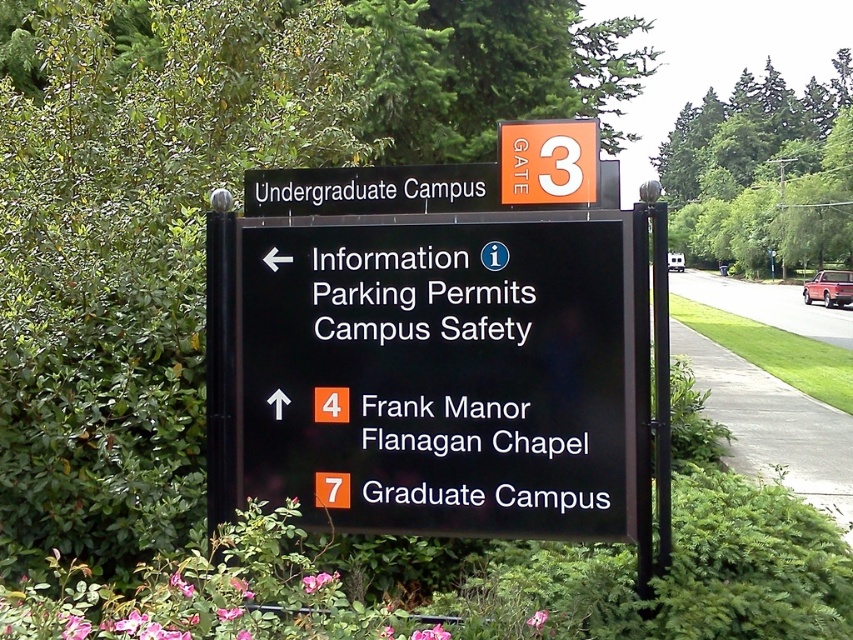
What is the location of the point with coordinates (469, 372) in the image?

The point with coordinates (469, 372) is located on the black plastic sign at center.

You are standing 10 feet away from the black plastic sign at upper center. Can you reach it without moving closer?

The black plastic sign at upper center is 11.12 feet away from you, so you cannot reach it without moving closer since you are currently 10 feet away.